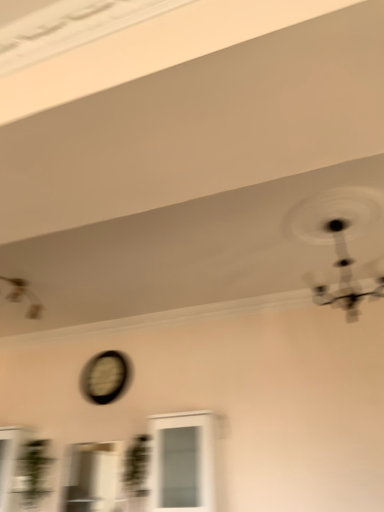
Question: Considering the relative sizes of clear glass window at center, positioned as the 2th window in right-to-left order, and white glass cabinet at center, positioned as the 2th window in left-to-right order, in the image provided, is clear glass window at center, positioned as the 2th window in right-to-left order, bigger than white glass cabinet at center, positioned as the 2th window in left-to-right order,?

Choices:
 (A) yes
 (B) no

Answer: (B)

Question: From the image's perspective, is clear glass window at center, positioned as the 2th window in right-to-left order, on white glass cabinet at center, positioned as the 2th window in left-to-right order?

Choices:
 (A) no
 (B) yes

Answer: (A)

Question: Is clear glass window at center, positioned as the 2th window in right-to-left order, thinner than white glass cabinet at center, the first window in the right-to-left sequence?

Choices:
 (A) yes
 (B) no

Answer: (A)

Question: Is the position of clear glass window at center, positioned as the 2th window in right-to-left order, less distant than that of white glass cabinet at center, the first window in the right-to-left sequence?

Choices:
 (A) yes
 (B) no

Answer: (B)

Question: Considering the relative sizes of clear glass window at center, positioned as the 2th window in right-to-left order, and white glass cabinet at center, positioned as the 2th window in left-to-right order, in the image provided, is clear glass window at center, positioned as the 2th window in right-to-left order, shorter than white glass cabinet at center, positioned as the 2th window in left-to-right order,?

Choices:
 (A) yes
 (B) no

Answer: (A)

Question: Is clear glass window at center, positioned as the 2th window in right-to-left order, beside white glass cabinet at center, the first window in the right-to-left sequence?

Choices:
 (A) no
 (B) yes

Answer: (A)

Question: From a real-world perspective, is white glass cabinet at center, the first window in the right-to-left sequence, positioned under metallic silver mechanical fan at upper right, which is counted as the second mechanical fan, starting from the back, based on gravity?

Choices:
 (A) yes
 (B) no

Answer: (A)

Question: Is white glass cabinet at center, positioned as the 2th window in left-to-right order, facing towards metallic silver mechanical fan at upper right, which is counted as the second mechanical fan, starting from the back?

Choices:
 (A) no
 (B) yes

Answer: (A)

Question: Is white glass cabinet at center, the first window in the right-to-left sequence, outside metallic silver mechanical fan at upper right, which is counted as the second mechanical fan, starting from the back?

Choices:
 (A) yes
 (B) no

Answer: (A)

Question: Is white glass cabinet at center, positioned as the 2th window in left-to-right order, wider than metallic silver mechanical fan at upper right, which is the first mechanical fan in right-to-left order?

Choices:
 (A) no
 (B) yes

Answer: (A)

Question: Can you confirm if white glass cabinet at center, the first window in the right-to-left sequence, is positioned to the right of metallic silver mechanical fan at upper right, which is counted as the second mechanical fan, starting from the back?

Choices:
 (A) no
 (B) yes

Answer: (A)

Question: Could metallic silver mechanical fan at upper right, the first mechanical fan from the front, be considered to be inside white glass cabinet at center, the first window in the right-to-left sequence?

Choices:
 (A) yes
 (B) no

Answer: (B)

Question: Can clear glass window at center, positioned as the 2th window in right-to-left order, be found inside white glass cabinet at center, positioned as the 2th window in left-to-right order?

Choices:
 (A) no
 (B) yes

Answer: (A)